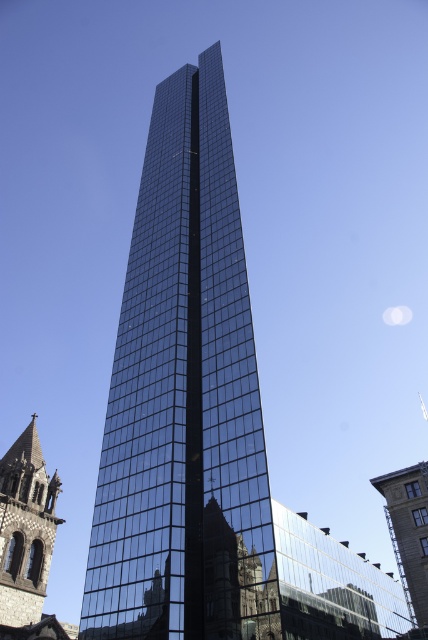
Question: Can you confirm if glossy glass tower at center is wider than dark brown stone church steeple at lower left?

Choices:
 (A) no
 (B) yes

Answer: (B)

Question: Is glossy glass tower at center thinner than dark brown stone church steeple at lower left?

Choices:
 (A) no
 (B) yes

Answer: (A)

Question: Which of the following is the closest to the observer?

Choices:
 (A) glassy reflective building at center
 (B) glossy glass tower at center
 (C) dark brown stone church steeple at lower left

Answer: (B)

Question: Can you confirm if glossy glass tower at center is positioned to the left of dark brown stone church steeple at lower left?

Choices:
 (A) yes
 (B) no

Answer: (B)

Question: Which of the following is the farthest from the observer?

Choices:
 (A) glassy reflective building at center
 (B) dark brown stone church steeple at lower left

Answer: (A)

Question: Considering the real-world distances, which object is closest to the glossy glass tower at center?

Choices:
 (A) glassy reflective building at center
 (B) dark brown stone church steeple at lower left

Answer: (B)